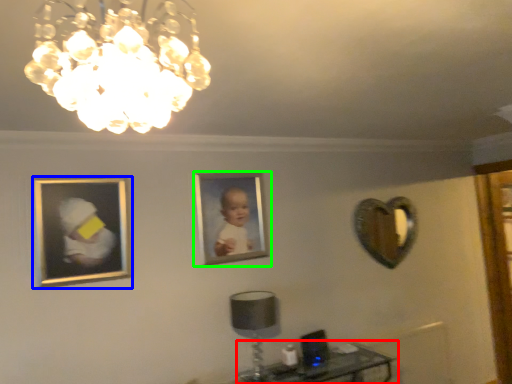
Question: Which object is positioned farthest from table (highlighted by a red box)? Select from picture frame (highlighted by a blue box) and picture frame (highlighted by a green box).

Choices:
 (A) picture frame
 (B) picture frame

Answer: (A)